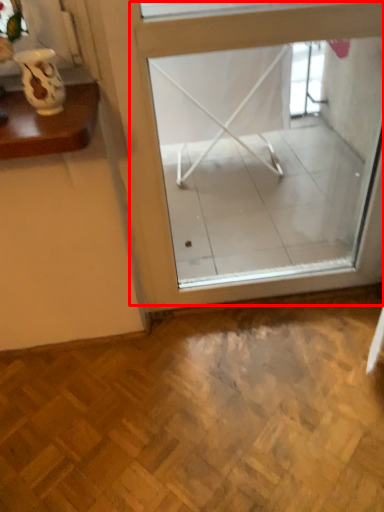
Question: In this image, where is window (annotated by the red box) located relative to vase?

Choices:
 (A) left
 (B) right

Answer: (B)